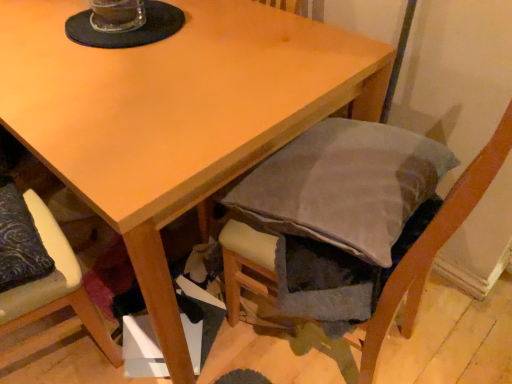
Question: From the image's perspective, is velvet-like beige cushion at lower left, acting as the 1th chair starting from the left, positioned above or below velvet gray cushion at lower right, positioned as the 2th chair in left-to-right order?

Choices:
 (A) above
 (B) below

Answer: (B)

Question: Is point (101, 327) closer or farther from the camera than point (227, 244)?

Choices:
 (A) farther
 (B) closer

Answer: (A)

Question: Is velvet-like beige cushion at lower left, acting as the 1th chair starting from the left, in front of or behind velvet gray cushion at lower right, positioned as the 2th chair in left-to-right order, in the image?

Choices:
 (A) behind
 (B) front

Answer: (A)

Question: Visually, is velvet gray cushion at lower right, positioned as the 2th chair in left-to-right order, positioned to the left or to the right of velvet-like beige cushion at lower left, acting as the 1th chair starting from the left?

Choices:
 (A) right
 (B) left

Answer: (A)

Question: Which is correct: velvet gray cushion at lower right, the first chair viewed from the right, is inside velvet-like beige cushion at lower left, which ranks as the second chair in right-to-left order, or outside of it?

Choices:
 (A) inside
 (B) outside

Answer: (B)

Question: From their relative heights in the image, would you say velvet gray cushion at lower right, positioned as the 2th chair in left-to-right order, is taller or shorter than velvet-like beige cushion at lower left, which ranks as the second chair in right-to-left order?

Choices:
 (A) tall
 (B) short

Answer: (A)

Question: Considering the positions of point (266, 289) and point (57, 235), is point (266, 289) closer or farther from the camera than point (57, 235)?

Choices:
 (A) closer
 (B) farther

Answer: (B)